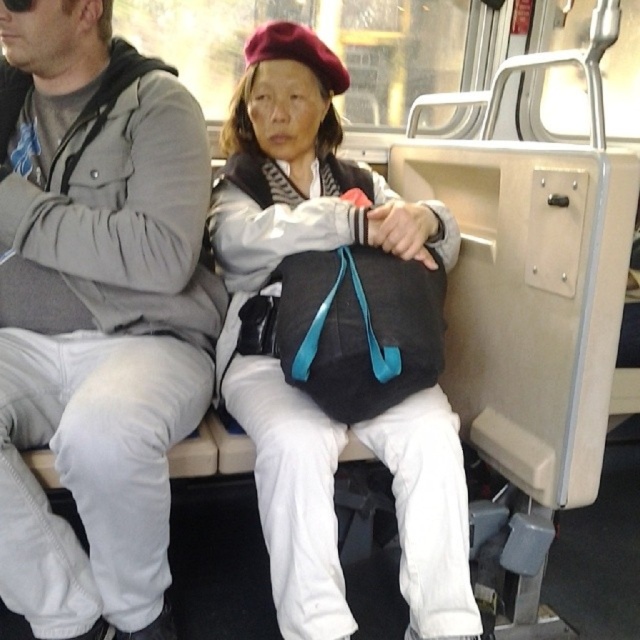
Question: Is gray cotton hoodie at left above matte black bag at center?

Choices:
 (A) yes
 (B) no

Answer: (B)

Question: Is gray cotton hoodie at left to the right of matte black bag at center from the viewer's perspective?

Choices:
 (A) yes
 (B) no

Answer: (B)

Question: Can you confirm if gray cotton hoodie at left is positioned to the right of matte black bag at center?

Choices:
 (A) yes
 (B) no

Answer: (B)